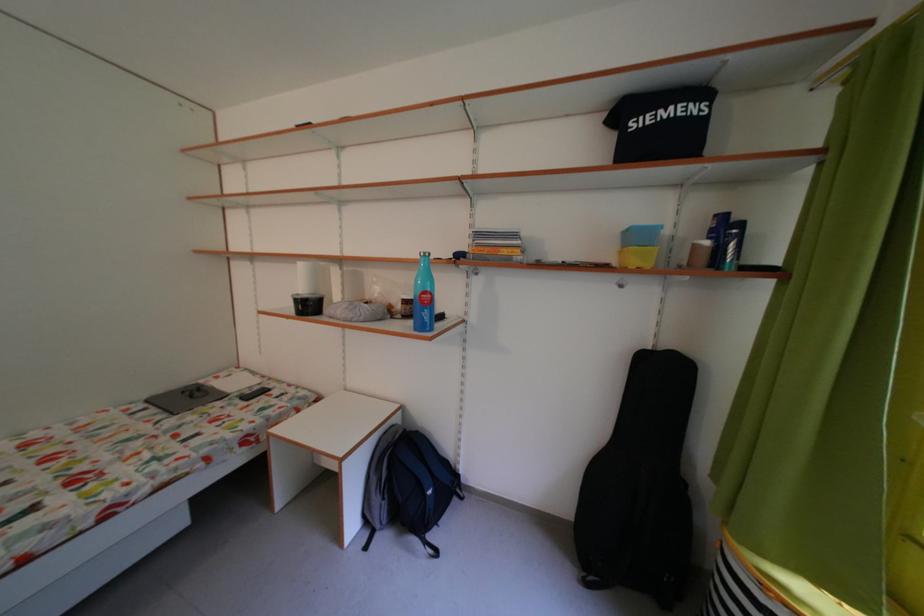
Where would you lift the aerosol spray can? Please return your answer as a coordinate pair (x, y).

(423, 296)